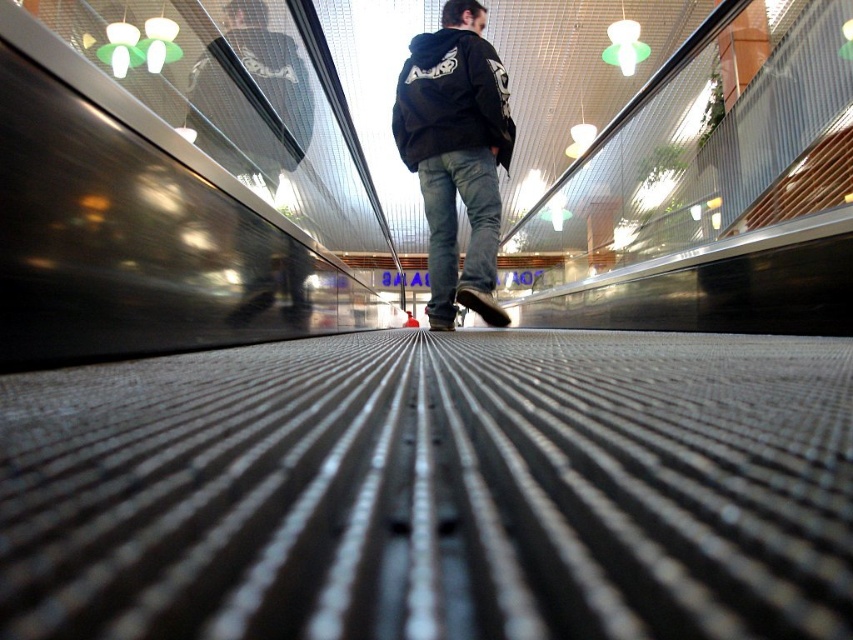
Question: Which of the following is the closest to the observer?

Choices:
 (A) black matte hoodie at center
 (B) denim at center

Answer: (A)

Question: Estimate the real-world distances between objects in this image. Which object is closer to the denim at center?

Choices:
 (A) black cotton hoodie at center
 (B) black matte hoodie at center

Answer: (B)

Question: Is black cotton hoodie at center thinner than denim at center?

Choices:
 (A) yes
 (B) no

Answer: (B)

Question: Is black matte hoodie at center smaller than black cotton hoodie at center?

Choices:
 (A) no
 (B) yes

Answer: (A)

Question: Among these objects, which one is farthest from the camera?

Choices:
 (A) black cotton hoodie at center
 (B) denim at center

Answer: (B)

Question: Does black matte hoodie at center appear over denim at center?

Choices:
 (A) no
 (B) yes

Answer: (B)